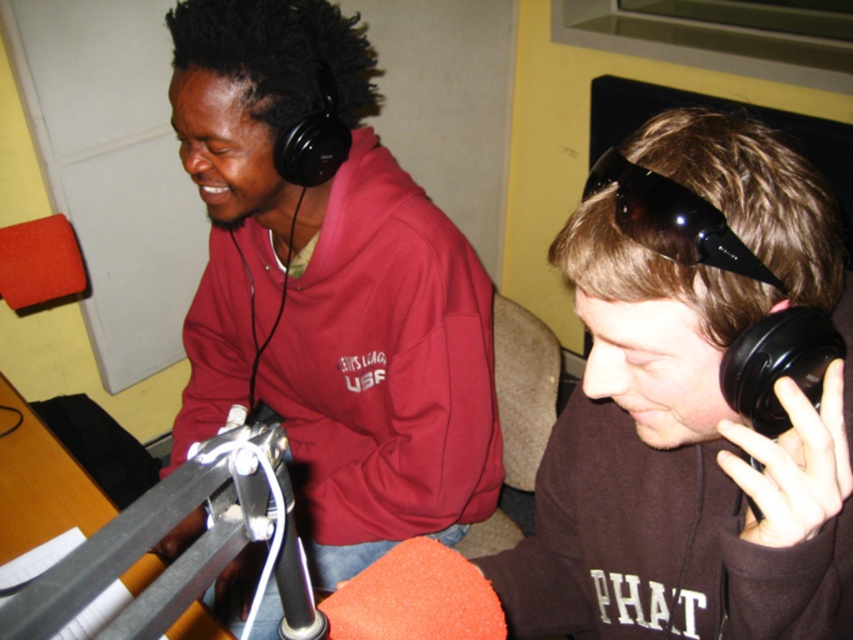
You are a photographer setting up a shoot in the scene described. You need to ensure that the brown matte hoodie at center and the black matte microphone at right are both visible in the frame. Given their sizes, which object should you prioritize positioning closer to the camera to maintain clarity and detail?

The brown matte hoodie at center is larger than the black matte microphone at right, so positioning it closer to the camera will help maintain clarity and detail for both objects while accounting for their size difference.

From the picture: What are the coordinates of the brown matte hoodie at center?

The coordinates of the brown matte hoodie at center are at point (691, 410).

You are a technician adjusting the microphone stand in the radio broadcasting session. The microphone is positioned at point (x=808, y=486). If you need to move the microphone closer to the viewer by 5 inches, will it be possible without exceeding the room dimensions?

The current distance of the microphone at point (x=808, y=486) from the viewer is 19.97 inches. Moving it closer by 5 inches would place it at 14.97 inches. Since the room dimensions aren not specified, it is assumed feasible unless restricted by unseen obstacles. However, based solely on the provided information, yes, it can be moved closer by 5 inches.